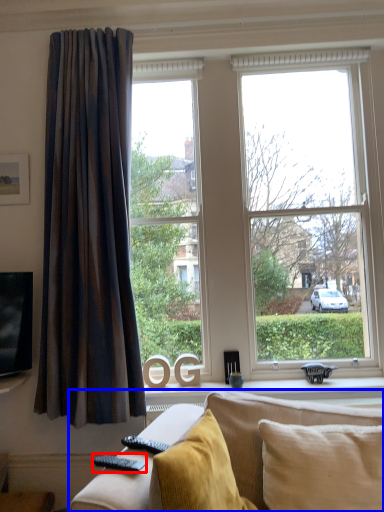
Question: Which object appears closest to the camera in this image, remote (highlighted by a red box) or studio couch (highlighted by a blue box)?

Choices:
 (A) remote
 (B) studio couch

Answer: (B)